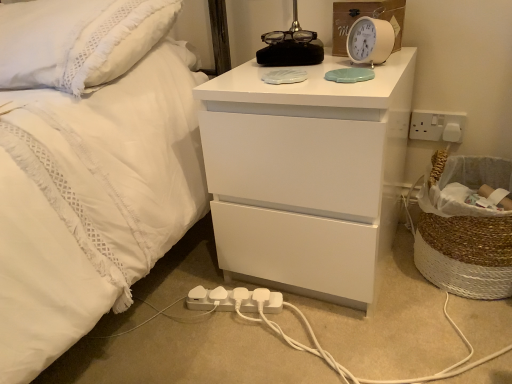
What is the approximate width of braided straw laundry basket at right?

13.60 inches.

Describe the element at coordinates (437, 125) in the screenshot. The height and width of the screenshot is (384, 512). I see `white plastic electric outlet at right` at that location.

This screenshot has width=512, height=384. Identify the location of white glossy chest of drawers at upper center. (306, 175).

Looking at the image, does white glossy chest of drawers at upper center seem bigger or smaller compared to braided straw laundry basket at right?

Considering their sizes, white glossy chest of drawers at upper center takes up more space than braided straw laundry basket at right.

Is white glossy chest of drawers at upper center inside the boundaries of braided straw laundry basket at right, or outside?

white glossy chest of drawers at upper center is not enclosed by braided straw laundry basket at right.

Which point is more distant from viewer, (308,197) or (438,191)?

The point (438,191) is farther.

What's the angular difference between white glossy chest of drawers at upper center and braided straw laundry basket at right's facing directions?

There is a 2.74-degree angle between the facing directions of white glossy chest of drawers at upper center and braided straw laundry basket at right.

Considering the relative sizes of white plastic electric outlet at right and white textured pillow at upper left in the image provided, is white plastic electric outlet at right smaller than white textured pillow at upper left?

Correct, white plastic electric outlet at right occupies less space than white textured pillow at upper left.

Is white textured pillow at upper left surrounded by white plastic electric outlet at right?

No, white textured pillow at upper left is not a part of white plastic electric outlet at right.

Does point (461, 122) come closer to viewer compared to point (77, 61)?

No, (461, 122) is further to viewer.

Does white plastic electric outlet at right come in front of white plastic extension cord at lower center?

No, it is behind white plastic extension cord at lower center.

The image size is (512, 384). I want to click on electric outlet that appears above the white plastic extension cord at lower center (from a real-world perspective), so click(x=437, y=125).

Could you tell me if white plastic electric outlet at right is turned towards white plastic extension cord at lower center?

No, white plastic electric outlet at right is not oriented towards white plastic extension cord at lower center.

Considering the sizes of objects white plastic electric outlet at right and white plastic extension cord at lower center in the image provided, who is bigger, white plastic electric outlet at right or white plastic extension cord at lower center?

With larger size is white plastic extension cord at lower center.

Does white glossy chest of drawers at upper center contain white textured pillow at upper left?

No, white textured pillow at upper left is located outside of white glossy chest of drawers at upper center.

Which object is wider, white glossy chest of drawers at upper center or white textured pillow at upper left?

white glossy chest of drawers at upper center is wider.

Considering the positions of objects white glossy chest of drawers at upper center and white textured pillow at upper left in the image provided, who is in front, white glossy chest of drawers at upper center or white textured pillow at upper left?

white glossy chest of drawers at upper center is closer to the camera.

Is point (226, 121) more distant than point (113, 42)?

No, it is in front of (113, 42).

Does white glossy chest of drawers at upper center have a lesser height compared to white plastic electric outlet at right?

In fact, white glossy chest of drawers at upper center may be taller than white plastic electric outlet at right.

Which is more to the left, white glossy chest of drawers at upper center or white plastic electric outlet at right?

white glossy chest of drawers at upper center is more to the left.

Between white glossy chest of drawers at upper center and white plastic electric outlet at right, which one has larger width?

With larger width is white glossy chest of drawers at upper center.

Consider the image. Are white glossy chest of drawers at upper center and white plastic electric outlet at right making contact?

white glossy chest of drawers at upper center is not next to white plastic electric outlet at right, and they're not touching.

Is white plastic alarm clock at upper right facing away from white glossy chest of drawers at upper center?

That's not correct — white plastic alarm clock at upper right is not looking away from white glossy chest of drawers at upper center.

Does white plastic alarm clock at upper right have a lesser height compared to white glossy chest of drawers at upper center?

Indeed, white plastic alarm clock at upper right has a lesser height compared to white glossy chest of drawers at upper center.

Considering the sizes of objects white plastic alarm clock at upper right and white glossy chest of drawers at upper center in the image provided, who is wider, white plastic alarm clock at upper right or white glossy chest of drawers at upper center?

white glossy chest of drawers at upper center.

Is white plastic extension cord at lower center further to the viewer compared to white plastic alarm clock at upper right?

That is True.

From the image's perspective, which one is positioned lower, white plastic extension cord at lower center or white plastic alarm clock at upper right?

white plastic extension cord at lower center is shown below in the image.

What are the coordinates of `laundry basket behind the white glossy chest of drawers at upper center` in the screenshot? It's located at (466, 232).

Identify the location of pillow lying in front of the white plastic electric outlet at right. The width and height of the screenshot is (512, 384). (77, 40).

From the image, which object appears to be farther from white plastic extension cord at lower center, white plastic electric outlet at right or white textured pillow at upper left?

The object further to white plastic extension cord at lower center is white plastic electric outlet at right.

Which object lies nearer to the anchor point white plastic alarm clock at upper right, white plastic extension cord at lower center or white textured pillow at upper left?

Among the two, white textured pillow at upper left is located nearer to white plastic alarm clock at upper right.

Looking at the image, which one is located closer to white glossy chest of drawers at upper center, white plastic extension cord at lower center or braided straw laundry basket at right?

Based on the image, braided straw laundry basket at right appears to be nearer to white glossy chest of drawers at upper center.

Looking at the image, which one is located further to braided straw laundry basket at right, white plastic extension cord at lower center or white textured pillow at upper left?

The object further to braided straw laundry basket at right is white textured pillow at upper left.

From the image, which object appears to be farther from white glossy chest of drawers at upper center, white plastic extension cord at lower center or white textured pillow at upper left?

white textured pillow at upper left is positioned further to the anchor white glossy chest of drawers at upper center.

From the picture: From the image, which object appears to be nearer to white plastic alarm clock at upper right, white plastic electric outlet at right or white plastic extension cord at lower center?

Among the two, white plastic electric outlet at right is located nearer to white plastic alarm clock at upper right.

When comparing their distances from white plastic electric outlet at right, does braided straw laundry basket at right or white glossy chest of drawers at upper center seem closer?

braided straw laundry basket at right lies closer to white plastic electric outlet at right than the other object.

Based on the photo, from the image, which object appears to be farther from white plastic electric outlet at right, white plastic extension cord at lower center or white glossy chest of drawers at upper center?

Based on the image, white plastic extension cord at lower center appears to be further to white plastic electric outlet at right.

What are the coordinates of `alarm clock between white glossy chest of drawers at upper center and white plastic electric outlet at right along the z-axis` in the screenshot? It's located at (370, 41).

The width and height of the screenshot is (512, 384). I want to click on alarm clock between white plastic extension cord at lower center and braided straw laundry basket at right from left to right, so pos(370,41).

Where is `alarm clock situated between white textured pillow at upper left and braided straw laundry basket at right from left to right`? The width and height of the screenshot is (512, 384). alarm clock situated between white textured pillow at upper left and braided straw laundry basket at right from left to right is located at coordinates (370, 41).

The width and height of the screenshot is (512, 384). What are the coordinates of `the chest of drawers located between white textured pillow at upper left and braided straw laundry basket at right in the left-right direction` in the screenshot? It's located at click(x=306, y=175).